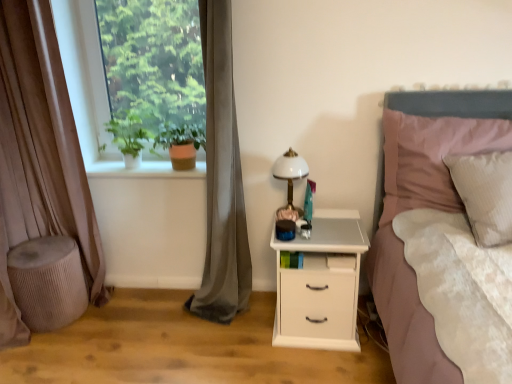
The width and height of the screenshot is (512, 384). Find the location of `vacant space in front of white matte nightstand at lower right`. vacant space in front of white matte nightstand at lower right is located at coordinates 319,365.